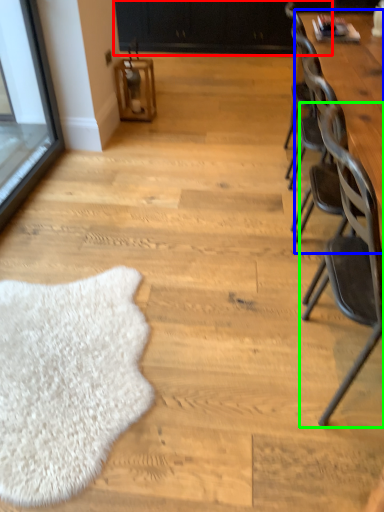
Question: Which object is the farthest from dresser (highlighted by a red box)? Choose among these: table (highlighted by a blue box) or chair (highlighted by a green box).

Choices:
 (A) table
 (B) chair

Answer: (B)